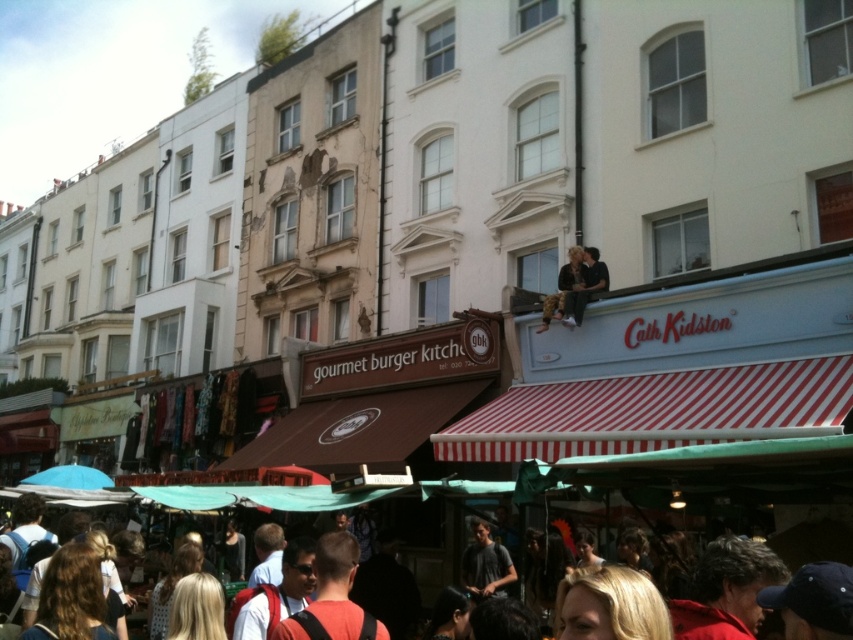
Is blonde hair at lower center to the left of camouflage pants at upper center from the viewer's perspective?

Indeed, blonde hair at lower center is positioned on the left side of camouflage pants at upper center.

Which is in front, point (279, 490) or point (573, 262)?

Point (279, 490)

Does point (285, 508) come behind point (573, 280)?

No, it is not.

Image resolution: width=853 pixels, height=640 pixels. I want to click on blonde hair at lower center, so click(318, 499).

Who is positioned more to the left, blonde hair at lower center or brown leather jacket at upper center?

Positioned to the left is blonde hair at lower center.

Measure the distance between point (225, 506) and camera.

They are 128.61 feet apart.

I want to click on blonde hair at lower center, so click(318, 499).

Is point (492, 557) closer to viewer compared to point (590, 250)?

Yes, point (492, 557) is in front of point (590, 250).

Between dark gray t-shirt at center and brown leather jacket at upper center, which one has more height?

dark gray t-shirt at center

Is point (485, 554) closer to camera compared to point (595, 292)?

Yes, it is in front of point (595, 292).

I want to click on dark gray t-shirt at center, so click(x=486, y=563).